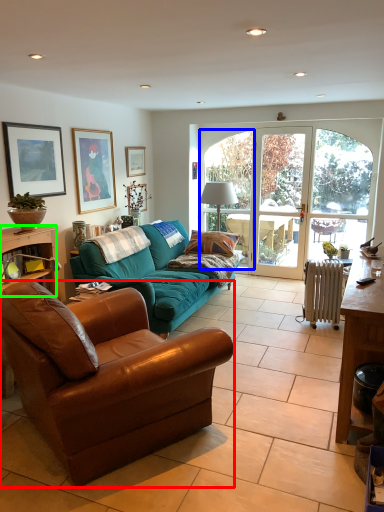
Question: Based on their relative distances, which object is farther from studio couch (highlighted by a red box)? Choose from window (highlighted by a blue box) and desk (highlighted by a green box).

Choices:
 (A) window
 (B) desk

Answer: (A)